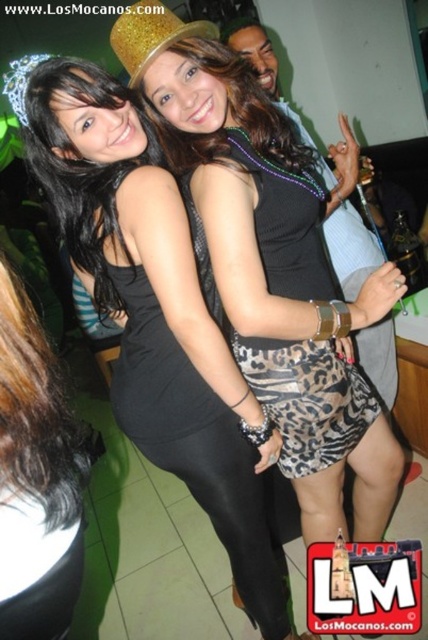
Question: Which object is the farthest from the silver metallic tiara at upper left?

Choices:
 (A) black matte hair at lower left
 (B) black matte dress at center

Answer: (B)

Question: Which of these objects is positioned farthest from the black matte hair at lower left?

Choices:
 (A) black matte dress at center
 (B) silver metallic tiara at upper left
 (C) leopard print skirt at center

Answer: (B)

Question: Does black matte hair at lower left come in front of leopard print skirt at center?

Choices:
 (A) no
 (B) yes

Answer: (B)

Question: Estimate the real-world distances between objects in this image. Which object is farther from the black matte hair at lower left?

Choices:
 (A) silver metallic tiara at upper left
 (B) leopard print skirt at center

Answer: (A)

Question: Can you confirm if black matte dress at center is bigger than silver metallic tiara at upper left?

Choices:
 (A) yes
 (B) no

Answer: (A)

Question: Is black matte dress at center closer to the viewer compared to black matte hair at lower left?

Choices:
 (A) no
 (B) yes

Answer: (A)